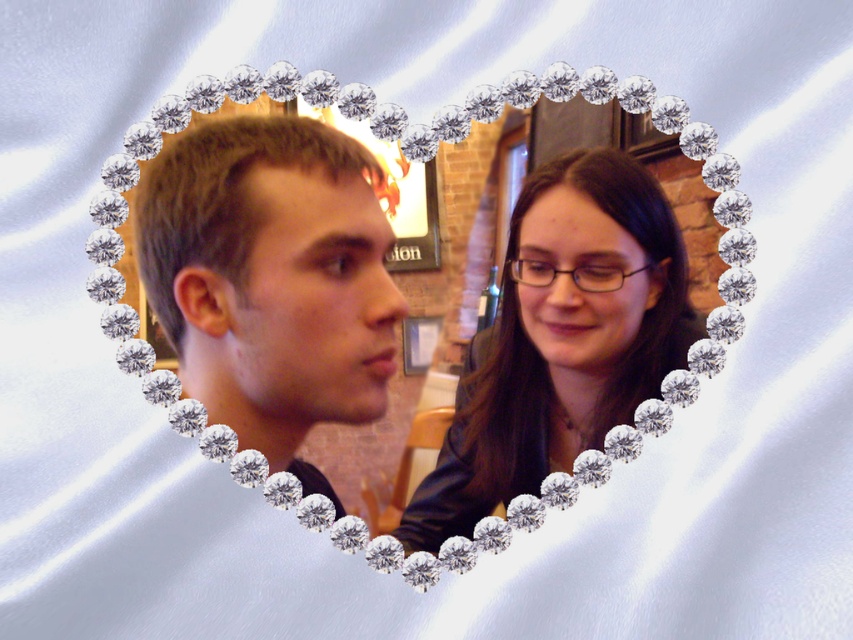
At what (x,y) coordinates should I click in order to perform the action: click on light brown hair at left. Please return your answer as a coordinate pair (x, y). This screenshot has width=853, height=640. Looking at the image, I should click on (271, 280).

Between light brown hair at left and smooth black hair at center, which one has more height?

Standing taller between the two is smooth black hair at center.

This screenshot has height=640, width=853. What do you see at coordinates (271, 280) in the screenshot?
I see `light brown hair at left` at bounding box center [271, 280].

Where is `light brown hair at left`? light brown hair at left is located at coordinates (271, 280).

Identify the location of matte black hair at center. (563, 342).

Which is behind, point (322, 264) or point (639, 358)?

The point (639, 358) is behind.

Between point (268, 461) and point (566, 308), which one is positioned in front?

Point (268, 461) is more forward.

Locate an element on the screen. Image resolution: width=853 pixels, height=640 pixels. matte black hair at center is located at coordinates (563, 342).

The image size is (853, 640). What are the coordinates of `matte black hair at center` in the screenshot? It's located at (563, 342).

Where is `matte black hair at center`? The image size is (853, 640). matte black hair at center is located at coordinates (563, 342).

Where is `matte black hair at center`? The height and width of the screenshot is (640, 853). matte black hair at center is located at coordinates (563, 342).